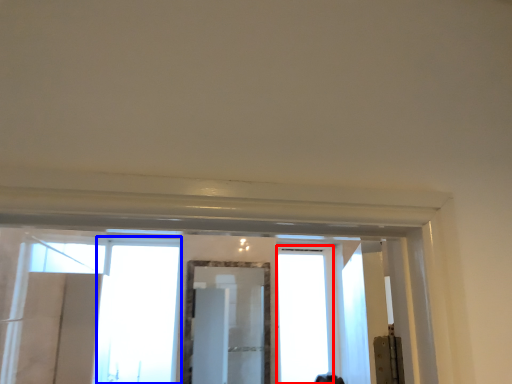
Question: Which object appears farthest to the camera in this image, window (highlighted by a red box) or window (highlighted by a blue box)?

Choices:
 (A) window
 (B) window

Answer: (A)